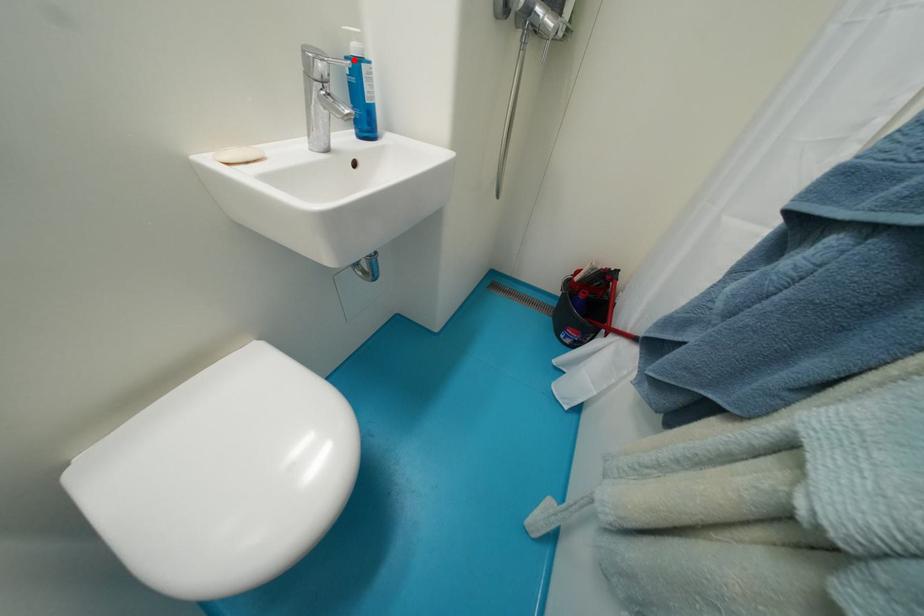
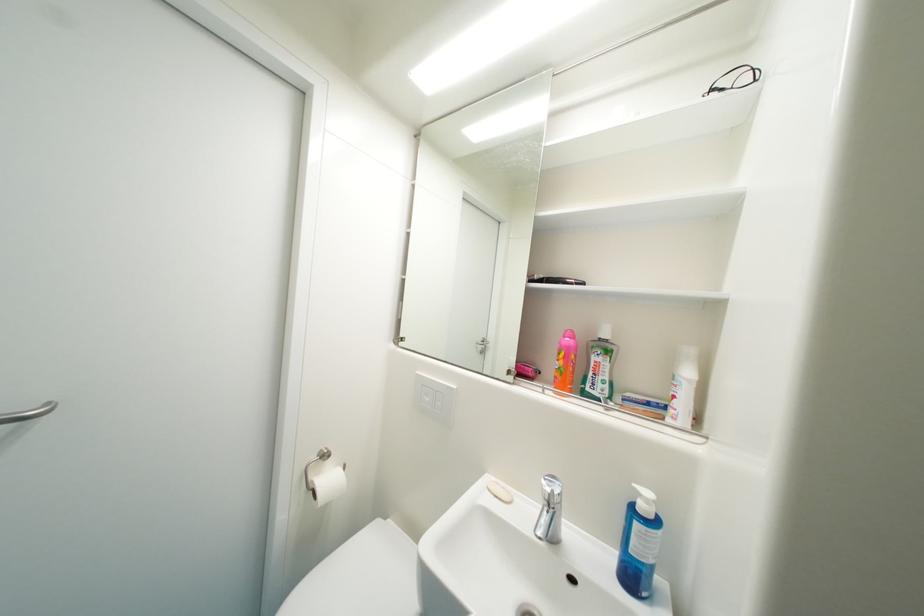
Find the pixel in the second image that matches the highlighted location in the first image.

(641, 507)